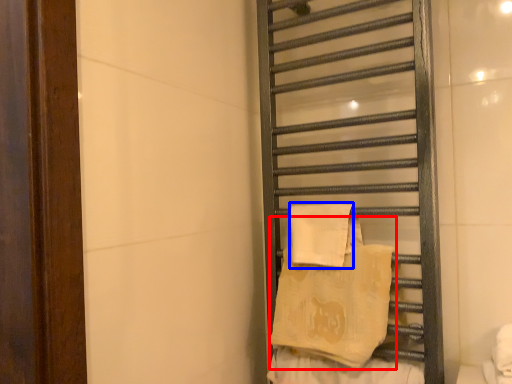
Question: Which object is closer to the camera taking this photo, beach towel (highlighted by a red box) or beach towel (highlighted by a blue box)?

Choices:
 (A) beach towel
 (B) beach towel

Answer: (A)